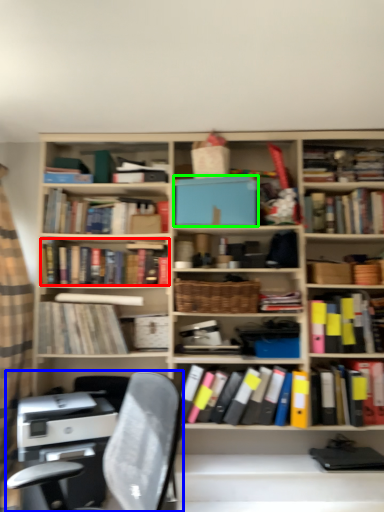
Question: Estimate the real-world distances between objects in this image. Which object is closer to book (highlighted by a red box), chair (highlighted by a blue box) or paperback book (highlighted by a green box)?

Choices:
 (A) chair
 (B) paperback book

Answer: (B)